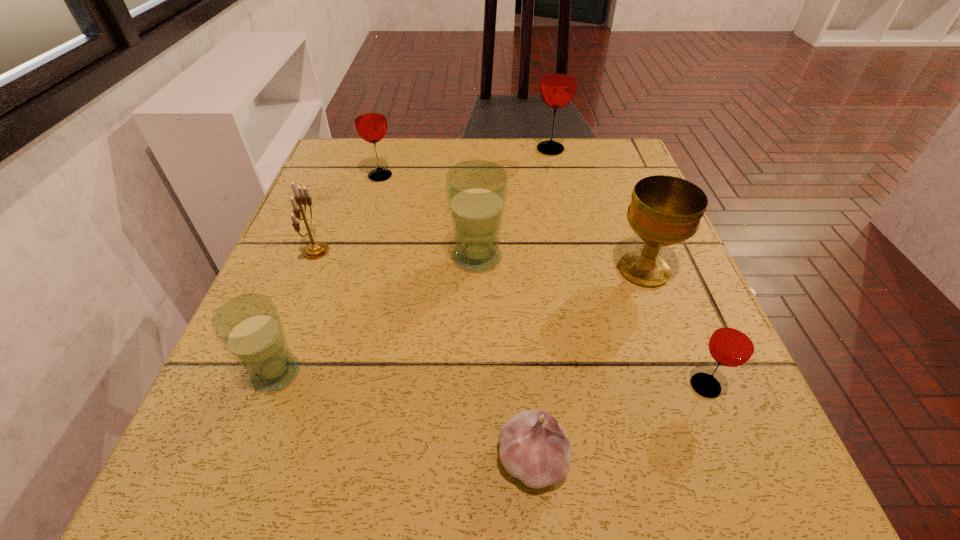
Find the location of a particular element. Image resolution: width=960 pixels, height=540 pixels. the rightmost glass is located at coordinates (732, 344).

The width and height of the screenshot is (960, 540). I want to click on the nearest red glass, so click(732, 344).

You are a GUI agent. You are given a task and a screenshot of the screen. Output one action in this format:
    pyautogui.click(x=<x>, y=<y>)
    Task: Click on the garlic
    The height and width of the screenshot is (540, 960).
    Given the screenshot: What is the action you would take?
    pyautogui.click(x=534, y=448)

Find the location of `the shortest object`. the shortest object is located at coordinates (534, 448).

Where is `vacant space located on the right of the tallest object`? Image resolution: width=960 pixels, height=540 pixels. vacant space located on the right of the tallest object is located at coordinates (614, 149).

Find the location of a particular element. This screenshot has width=960, height=540. blank space located on the right of the leftmost red glass is located at coordinates (564, 176).

Find the location of a particular element. The height and width of the screenshot is (540, 960). vacant area situated 0.130m on the front of the third glass from left to right is located at coordinates (476, 333).

Where is `vacant area located on the left of the chalice`? The image size is (960, 540). vacant area located on the left of the chalice is located at coordinates (456, 270).

The height and width of the screenshot is (540, 960). Find the location of `free spot located 0.240m on the right of the gold candelabrum`. free spot located 0.240m on the right of the gold candelabrum is located at coordinates (452, 251).

At what (x,y) coordinates should I click in order to perform the action: click on vacant area situated on the right of the left blue glass. Please return your answer as a coordinate pair (x, y). This screenshot has height=540, width=960. Looking at the image, I should click on (503, 373).